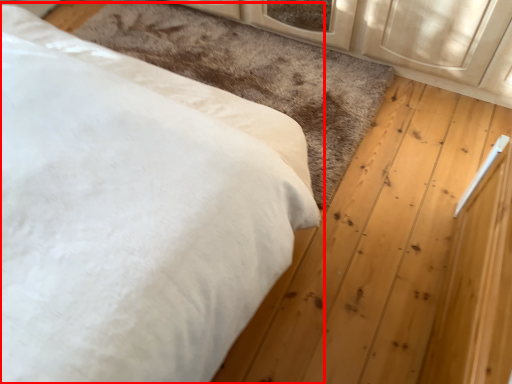
Question: From the image, what is the correct spatial relationship of bed (annotated by the red box) in relation to mat?

Choices:
 (A) left
 (B) right

Answer: (A)